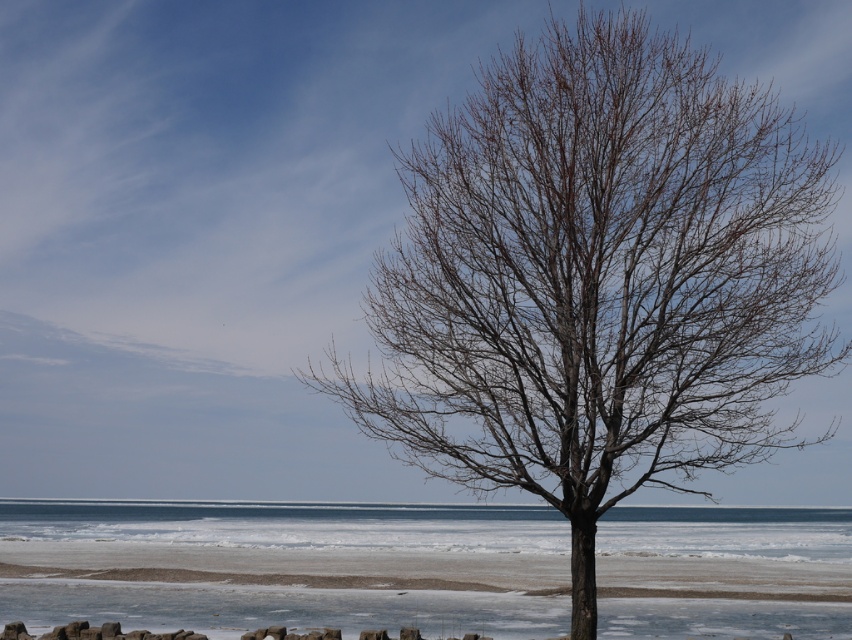
In the scene shown: You are standing on the beach looking at the coastal scene. You notice a point marked at coordinates (597, 278). What object does this point correspond to?

The point at coordinates (597, 278) corresponds to the bare branches at center.

You are an ornithologist observing the coastal scene. You notice the bare branches at center and the frozen ice at lower center. Which of these two features is shorter in height?

The bare branches at center has a lesser height compared to frozen ice at lower center, so the bare branches at center is shorter in height.